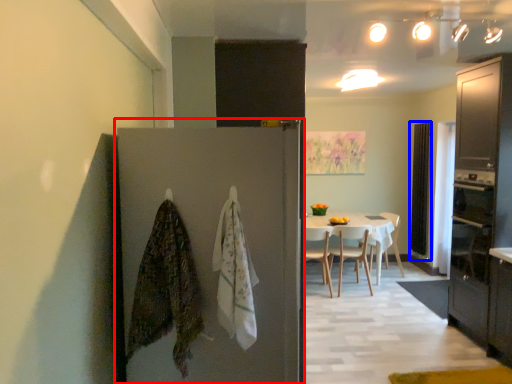
Question: Which of the following is the farthest to the observer, door (highlighted by a red box) or screen door (highlighted by a blue box)?

Choices:
 (A) door
 (B) screen door

Answer: (B)